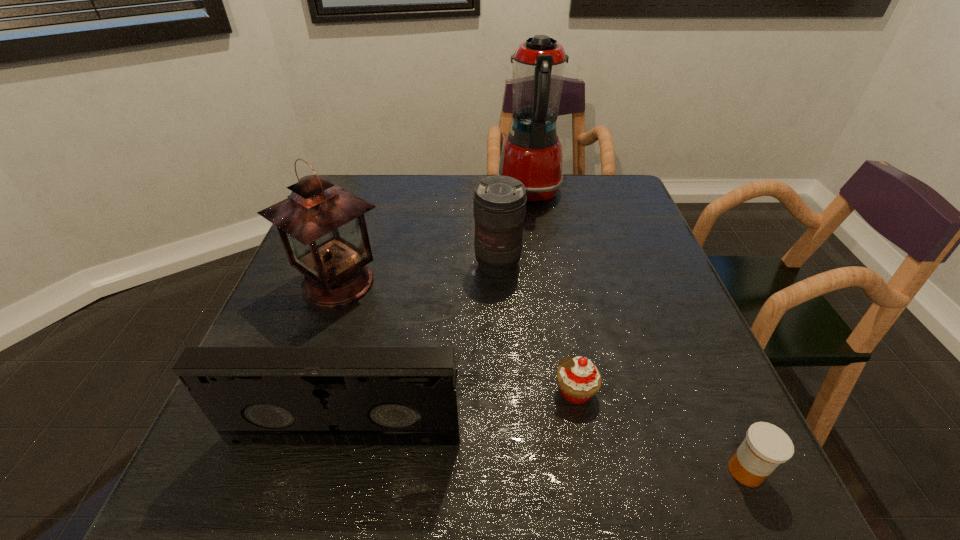
Identify the location of free region located 0.240m on the controls of the food processor. [419, 193].

This screenshot has height=540, width=960. Identify the location of vacant position located 0.360m on the front of the second tallest object. (265, 492).

I want to click on vacant region located 0.180m on the side of the telephoto lens where the control switches are located, so click(x=501, y=339).

At what (x,y) coordinates should I click in order to perform the action: click on free space located on the front side of the videotape. Please return your answer as a coordinate pair (x, y). This screenshot has width=960, height=540. Looking at the image, I should click on (326, 515).

The height and width of the screenshot is (540, 960). What are the coordinates of `vacant position located on the back of the fourth farthest object` in the screenshot? It's located at (549, 249).

This screenshot has width=960, height=540. What are the coordinates of `object situated at the far edge` in the screenshot? It's located at (532, 152).

You are a GUI agent. You are given a task and a screenshot of the screen. Output one action in this format:
    pyautogui.click(x=<x>, y=<y>)
    Task: Click on the object that is at the near edge
    The height and width of the screenshot is (540, 960).
    Given the screenshot: What is the action you would take?
    pyautogui.click(x=766, y=446)

Image resolution: width=960 pixels, height=540 pixels. Identify the location of oil lamp at the left edge. (322, 226).

Where is `videotape located at the left edge`? The width and height of the screenshot is (960, 540). videotape located at the left edge is located at coordinates (251, 395).

Locate an element on the screen. This screenshot has height=540, width=960. object positioned at the right edge is located at coordinates (766, 446).